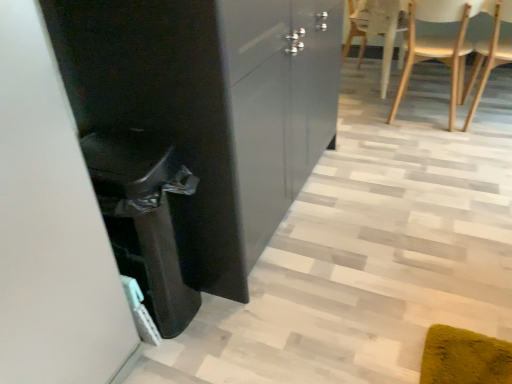
Question: Considering the relative sizes of wooden at right, which is the 2th chair from left to right, and white wood chair at upper right, which is the 1th chair from left to right, in the image provided, is wooden at right, which is the 2th chair from left to right, bigger than white wood chair at upper right, which is the 1th chair from left to right,?

Choices:
 (A) no
 (B) yes

Answer: (A)

Question: From the image's perspective, is wooden at right, which is the 2th chair from left to right, under white wood chair at upper right, which is the 1th chair from left to right?

Choices:
 (A) no
 (B) yes

Answer: (B)

Question: Is wooden at right, which is the 2th chair from left to right, to the left of white wood chair at upper right, which is the 2th chair from right to left, from the viewer's perspective?

Choices:
 (A) no
 (B) yes

Answer: (A)

Question: Does wooden at right, positioned as the first chair in right-to-left order, have a greater width compared to white wood chair at upper right, which is the 2th chair from right to left?

Choices:
 (A) no
 (B) yes

Answer: (B)

Question: Is the surface of wooden at right, which is the 2th chair from left to right, in direct contact with white wood chair at upper right, which is the 1th chair from left to right?

Choices:
 (A) yes
 (B) no

Answer: (B)

Question: Is wooden at right, positioned as the first chair in right-to-left order, outside white wood chair at upper right, which is the 1th chair from left to right?

Choices:
 (A) no
 (B) yes

Answer: (B)

Question: Is wooden at right, which is the 2th chair from left to right, located outside glossy black cabinet at center?

Choices:
 (A) yes
 (B) no

Answer: (A)

Question: From a real-world perspective, is wooden at right, which is the 2th chair from left to right, physically below glossy black cabinet at center?

Choices:
 (A) no
 (B) yes

Answer: (B)

Question: Is glossy black cabinet at center completely or partially inside wooden at right, which is the 2th chair from left to right?

Choices:
 (A) no
 (B) yes

Answer: (A)

Question: Does wooden at right, positioned as the first chair in right-to-left order, have a lesser height compared to glossy black cabinet at center?

Choices:
 (A) yes
 (B) no

Answer: (A)

Question: Can you confirm if wooden at right, which is the 2th chair from left to right, is positioned to the left of glossy black cabinet at center?

Choices:
 (A) yes
 (B) no

Answer: (B)

Question: Does wooden at right, positioned as the first chair in right-to-left order, have a lesser width compared to glossy black cabinet at center?

Choices:
 (A) no
 (B) yes

Answer: (B)

Question: Does white wood chair at upper right, which is the 1th chair from left to right, have a lesser width compared to wooden at right, positioned as the first chair in right-to-left order?

Choices:
 (A) no
 (B) yes

Answer: (B)